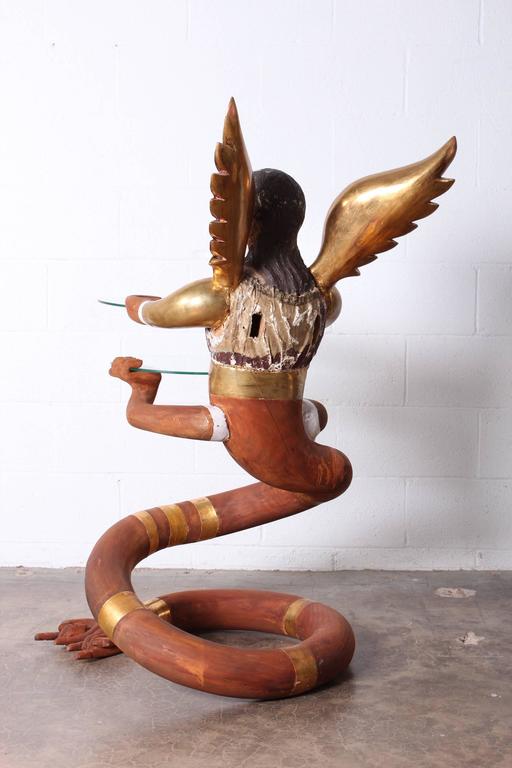
Identify the location of white brick wall. (432, 441).